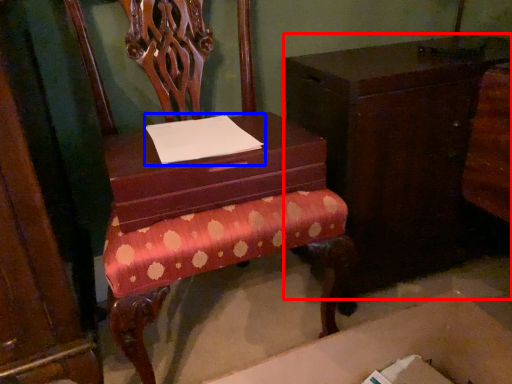
Question: Which of the following is the farthest to the observer, furniture (highlighted by a red box) or notepad (highlighted by a blue box)?

Choices:
 (A) furniture
 (B) notepad

Answer: (A)